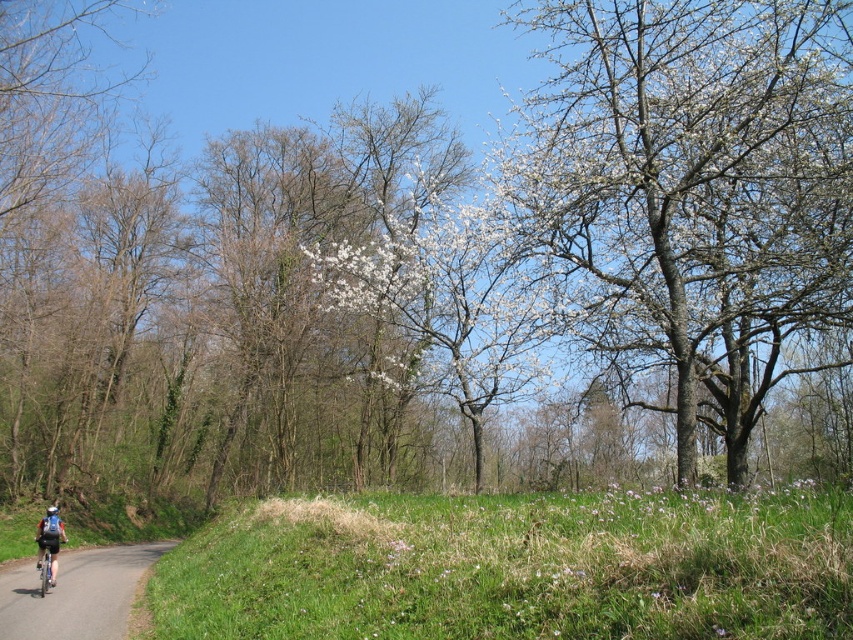
Question: Considering the relative positions of smooth asphalt road at lower left and dark blue fabric backpack at lower left in the image provided, where is smooth asphalt road at lower left located with respect to dark blue fabric backpack at lower left?

Choices:
 (A) below
 (B) above

Answer: (A)

Question: Which of the following is the closest to the observer?

Choices:
 (A) (97, 554)
 (B) (51, 509)
 (C) (61, 520)

Answer: (B)

Question: Does dark blue fabric backpack at lower left appear on the right side of blue matte helmet at lower left?

Choices:
 (A) no
 (B) yes

Answer: (B)

Question: Which of the following is the closest to the observer?

Choices:
 (A) (115, 547)
 (B) (59, 532)
 (C) (54, 509)

Answer: (B)

Question: Does smooth asphalt road at lower left have a greater width compared to blue matte helmet at lower left?

Choices:
 (A) yes
 (B) no

Answer: (A)

Question: Estimate the real-world distances between objects in this image. Which object is farther from the blue matte helmet at lower left?

Choices:
 (A) dark blue fabric backpack at lower left
 (B) smooth asphalt road at lower left

Answer: (B)